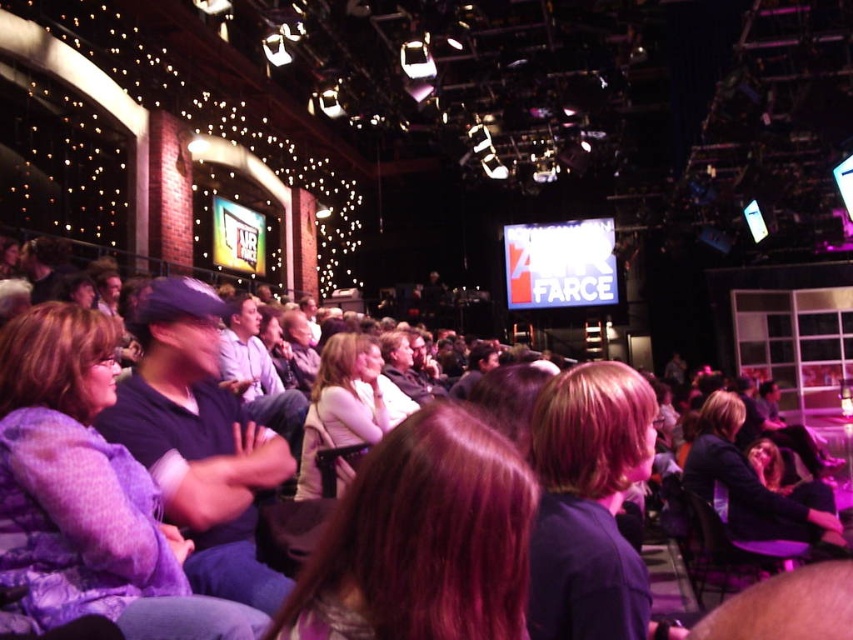
Is point (99, 538) closer to camera compared to point (715, 451)?

Yes, point (99, 538) is in front of point (715, 451).

Is point (51, 426) positioned in front of point (824, 538)?

That is True.

Identify the location of purple fuzzy coat at left. (86, 493).

The width and height of the screenshot is (853, 640). What do you see at coordinates (422, 540) in the screenshot?
I see `smooth brown hair at center` at bounding box center [422, 540].

Does point (433, 474) come behind point (347, 384)?

No, (433, 474) is closer to viewer.

Between point (332, 632) and point (337, 467), which one is positioned behind?

The point (337, 467) is behind.

The width and height of the screenshot is (853, 640). What are the coordinates of `smooth brown hair at center` in the screenshot? It's located at pyautogui.click(x=422, y=540).

Between white sweater at center and light blue shirt at center, which one is positioned lower?

white sweater at center is lower down.

Which is more to the right, white sweater at center or light blue shirt at center?

white sweater at center is more to the right.

Between point (311, 476) and point (231, 365), which one is positioned behind?

Point (231, 365)

The width and height of the screenshot is (853, 640). Identify the location of white sweater at center. (340, 406).